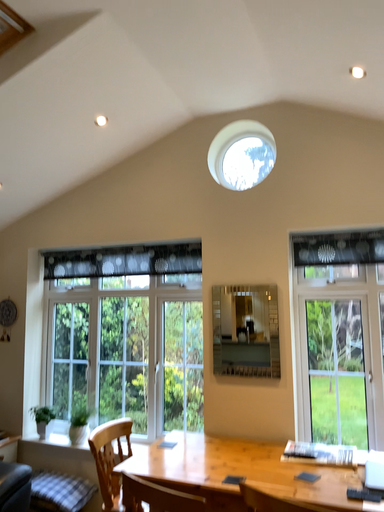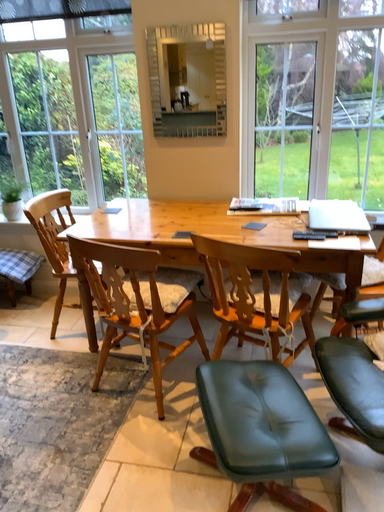
Question: Which way did the camera rotate in the video?

Choices:
 (A) rotated upward
 (B) rotated downward

Answer: (B)